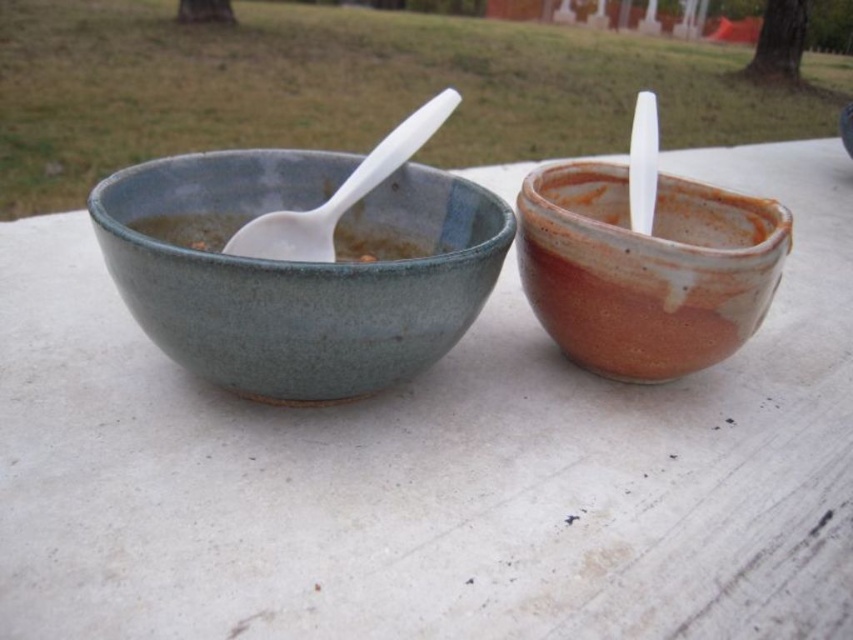
Who is more forward, (607,314) or (184,232)?

Point (607,314) is more forward.

Is matte clay bowl at right thinner than matte ceramic soup at left?

Indeed, matte clay bowl at right has a lesser width compared to matte ceramic soup at left.

Where is `matte clay bowl at right`? The width and height of the screenshot is (853, 640). matte clay bowl at right is located at coordinates (645, 269).

Which is behind, point (688, 202) or point (247, 234)?

Positioned behind is point (688, 202).

Is matte clay bowl at right thinner than white plastic spoon at left?

No.

Describe the element at coordinates (645, 269) in the screenshot. This screenshot has height=640, width=853. I see `matte clay bowl at right` at that location.

This screenshot has height=640, width=853. What are the coordinates of `matte clay bowl at right` in the screenshot? It's located at (645, 269).

Can you confirm if white plastic spoon at left is thinner than matte ceramic soup at left?

Yes, white plastic spoon at left is thinner than matte ceramic soup at left.

Is point (331, 216) positioned before point (352, 225)?

Yes, it is.

Between point (325, 232) and point (149, 218), which one is positioned behind?

Point (325, 232)

You are a GUI agent. You are given a task and a screenshot of the screen. Output one action in this format:
    pyautogui.click(x=<x>, y=<y>)
    Task: Click on the white plastic spoon at left
    The image size is (853, 640).
    Given the screenshot: What is the action you would take?
    pyautogui.click(x=339, y=195)